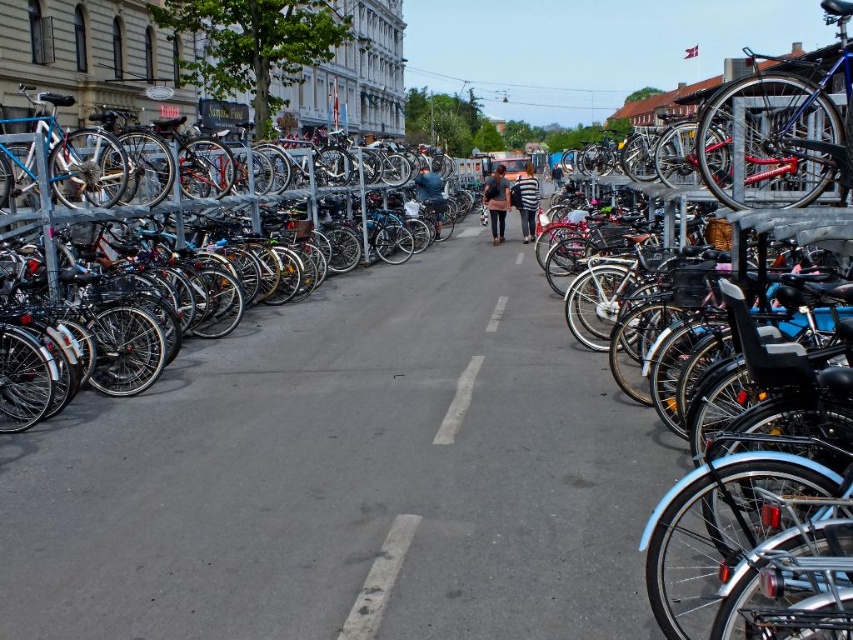
How much distance is there between white asphalt road at center and dark blue jeans at center?

white asphalt road at center and dark blue jeans at center are 43.62 meters apart.

Does white asphalt road at center have a smaller size compared to dark blue jeans at center?

Yes.

Describe the element at coordinates (379, 579) in the screenshot. I see `white asphalt road at center` at that location.

I want to click on white asphalt road at center, so click(x=379, y=579).

Between shiny metallic bicycle at left and white asphalt road at center, which one appears on the right side from the viewer's perspective?

Positioned to the right is white asphalt road at center.

Measure the distance from shiny metallic bicycle at left to white asphalt road at center.

shiny metallic bicycle at left and white asphalt road at center are 7.42 meters apart.

Is point (368, 196) in front of point (387, 531)?

That is False.

This screenshot has width=853, height=640. Find the location of `shiny metallic bicycle at left`. shiny metallic bicycle at left is located at coordinates 128,355.

Does white asphalt road at center appear over dark blue shirt at center?

Actually, white asphalt road at center is below dark blue shirt at center.

At what (x,y) coordinates should I click in order to perform the action: click on white asphalt road at center. Please return your answer as a coordinate pair (x, y). Looking at the image, I should click on (379, 579).